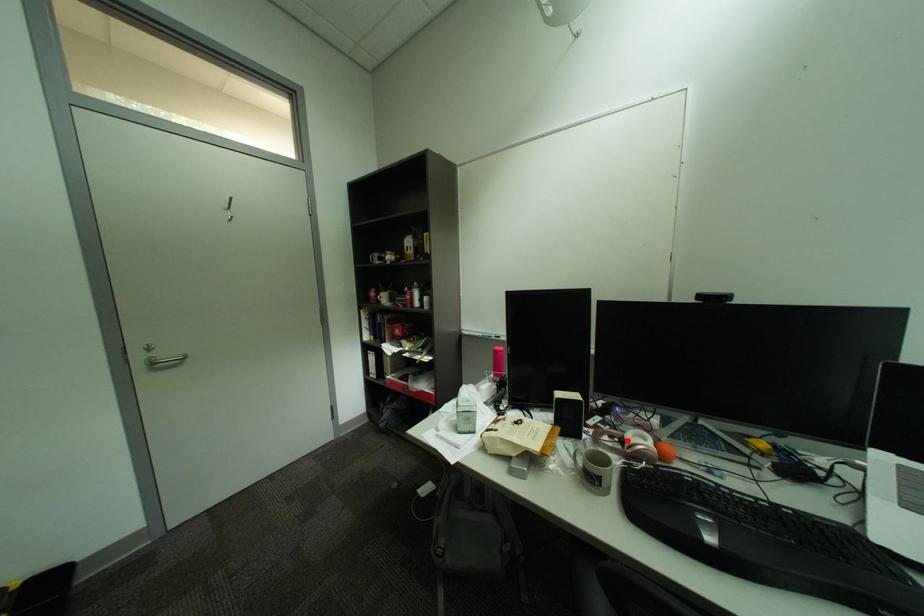
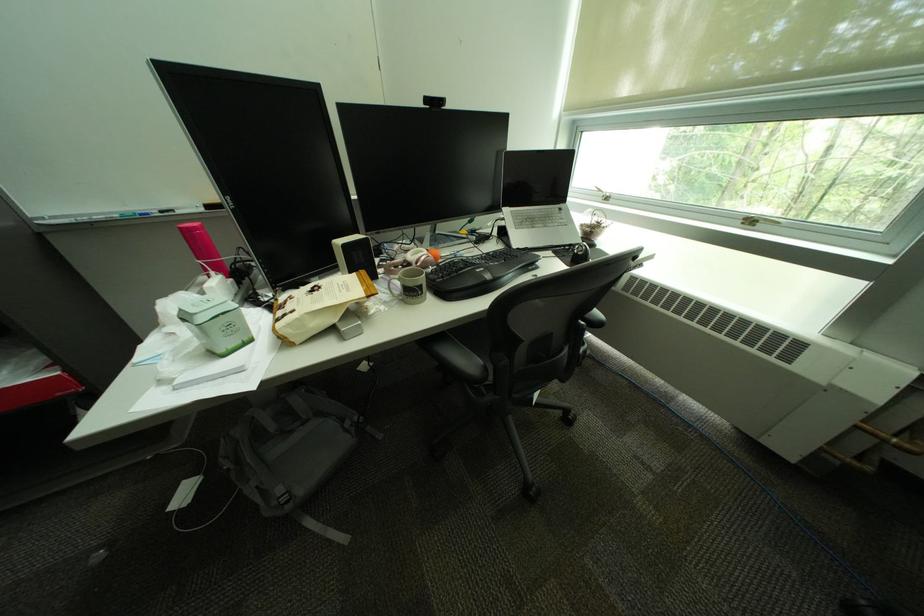
In the second image, find the point that corresponds to the highlighted location in the first image.

(410, 268)